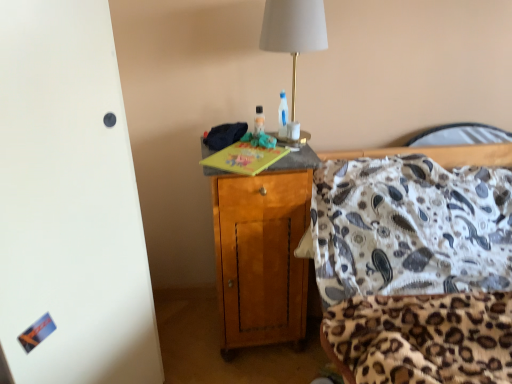
Question: Is wooden cabinet at center taller or shorter than white fabric lampshade at upper center?

Choices:
 (A) short
 (B) tall

Answer: (B)

Question: In the image, is wooden cabinet at center positioned in front of or behind white fabric lampshade at upper center?

Choices:
 (A) behind
 (B) front

Answer: (A)

Question: Which of these objects is positioned farthest from the wooden cabinet at center?

Choices:
 (A) translucent plastic bottle at center
 (B) white fabric lampshade at upper center

Answer: (B)

Question: Which object is positioned closest to the white fabric lampshade at upper center?

Choices:
 (A) wooden cabinet at center
 (B) translucent plastic bottle at center

Answer: (B)